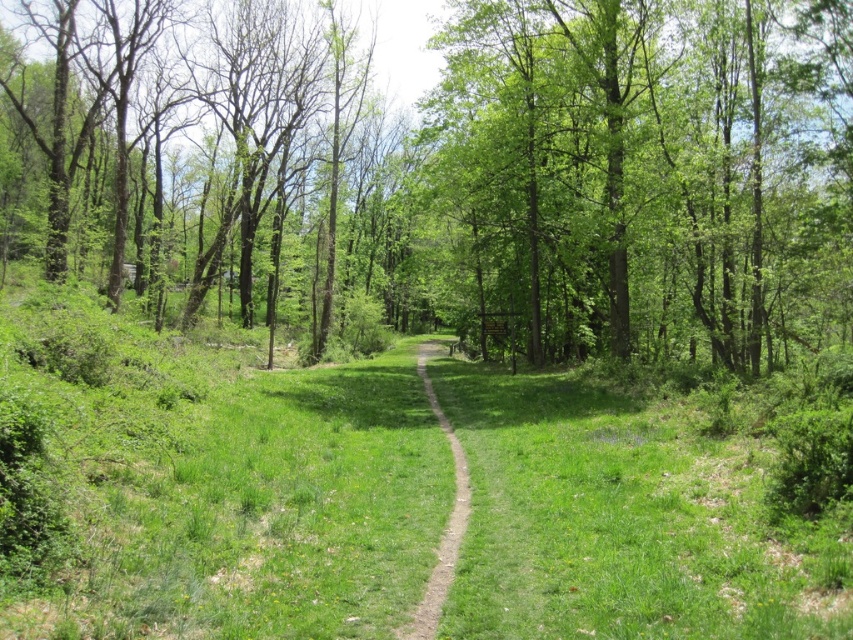
Question: Which point appears closest to the camera in this image?

Choices:
 (A) (408, 624)
 (B) (526, 116)

Answer: (A)

Question: Does green leafy tree at center have a greater width compared to dirt path at center?

Choices:
 (A) no
 (B) yes

Answer: (B)

Question: Is green leafy tree at center to the left of dirt path at center from the viewer's perspective?

Choices:
 (A) yes
 (B) no

Answer: (A)

Question: Does green leafy tree at center have a greater width compared to dirt path at center?

Choices:
 (A) no
 (B) yes

Answer: (B)

Question: Which point is farther from the camera taking this photo?

Choices:
 (A) (456, 534)
 (B) (491, 220)

Answer: (B)